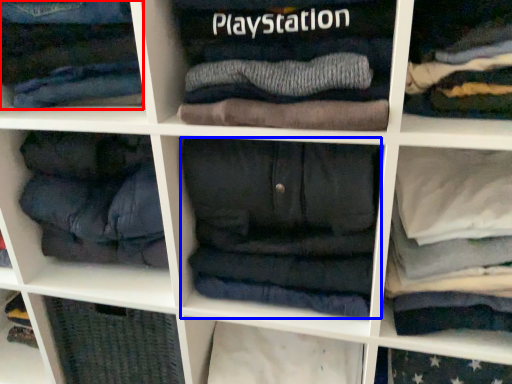
Question: Which object appears farthest to the camera in this image, clothing (highlighted by a red box) or clothing (highlighted by a blue box)?

Choices:
 (A) clothing
 (B) clothing

Answer: (B)